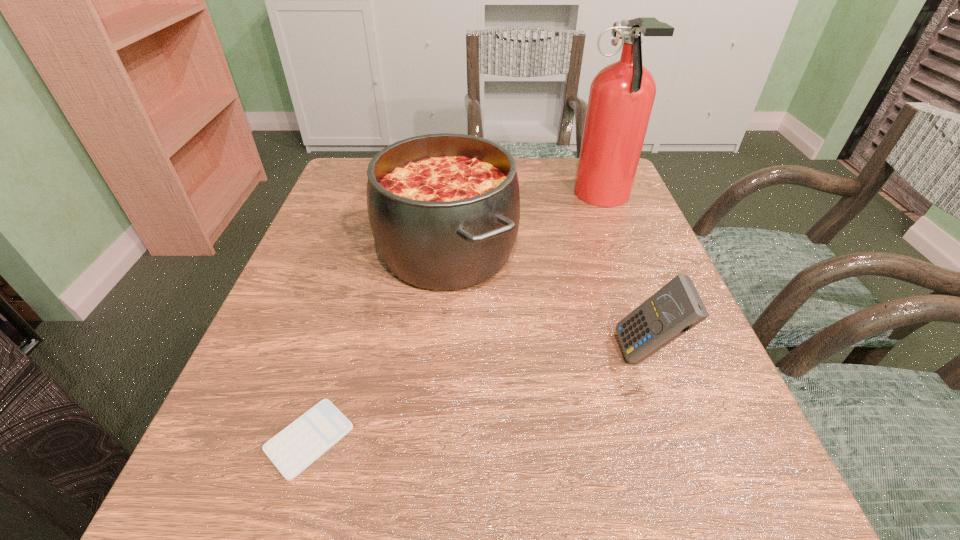
Locate an element on the screen. empty location between the casserole and the taller calculator is located at coordinates (546, 302).

In order to click on empty location between the shorter calculator and the right calculator in this screenshot , I will do `click(478, 396)`.

This screenshot has width=960, height=540. Identify the location of empty location between the nearest object and the fire extinguisher. (456, 319).

Image resolution: width=960 pixels, height=540 pixels. What are the coordinates of `vacant space that is in between the tallest object and the third shortest object` in the screenshot? It's located at (525, 224).

Locate an element on the screen. Image resolution: width=960 pixels, height=540 pixels. free point between the taller calculator and the fire extinguisher is located at coordinates (624, 275).

You are a GUI agent. You are given a task and a screenshot of the screen. Output one action in this format:
    pyautogui.click(x=<x>, y=<y>)
    Task: Click on the blank region between the casserole and the left calculator
    
    Given the screenshot: What is the action you would take?
    pyautogui.click(x=378, y=345)

This screenshot has width=960, height=540. I want to click on free area in between the third shortest object and the shortest object, so click(378, 345).

Identify the location of free space between the second tallest object and the taller calculator. The height and width of the screenshot is (540, 960). (546, 302).

Identify the location of vacant area between the tallest object and the casserole. (525, 224).

What are the coordinates of `object that stands as the second closest to the nearest object` in the screenshot? It's located at (676, 308).